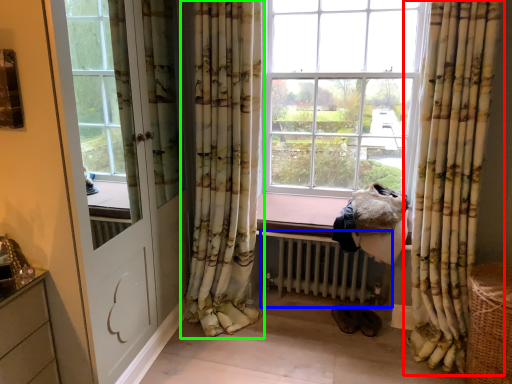
Question: Considering the real-world distances, which object is farthest from curtain (highlighted by a red box)? radiator (highlighted by a blue box) or curtain (highlighted by a green box)?

Choices:
 (A) radiator
 (B) curtain

Answer: (B)